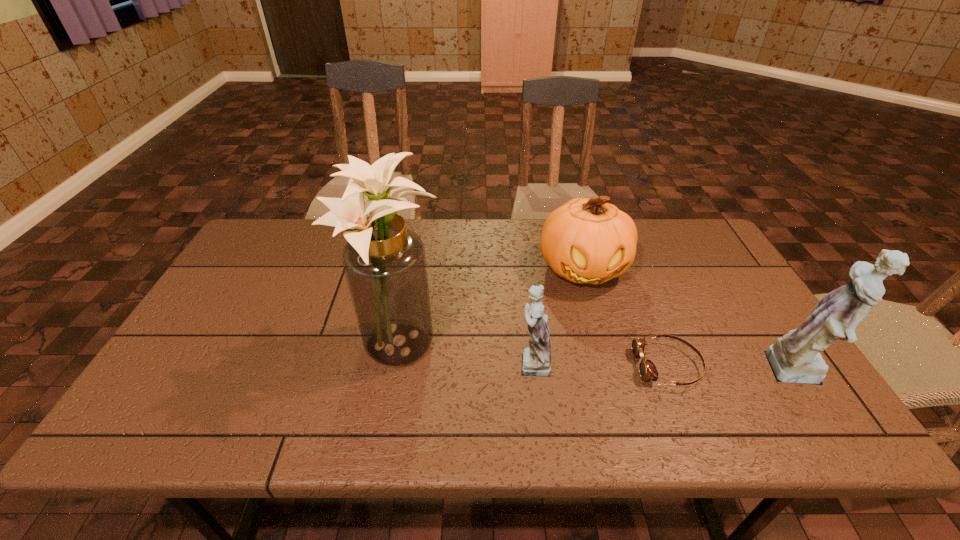
Locate an element on the screen. the left figurine is located at coordinates (536, 360).

In order to click on the rightmost object in this screenshot , I will do `click(795, 358)`.

Image resolution: width=960 pixels, height=540 pixels. I want to click on the taller figurine, so click(x=795, y=358).

Where is `the farthest object`? the farthest object is located at coordinates click(x=587, y=240).

The height and width of the screenshot is (540, 960). In order to click on goggles in this screenshot , I will do `click(647, 369)`.

Locate an element on the screen. flower arrangement is located at coordinates [x=384, y=262].

The height and width of the screenshot is (540, 960). I want to click on the tallest object, so click(384, 262).

Find the location of a particular element. The height and width of the screenshot is (540, 960). free space located 0.070m on the front-facing side of the shorter figurine is located at coordinates (482, 362).

Locate an element on the screen. The height and width of the screenshot is (540, 960). vacant area situated on the front-facing side of the shorter figurine is located at coordinates (354, 362).

This screenshot has height=540, width=960. In order to click on vacant space located 0.350m on the front-facing side of the shorter figurine in this screenshot , I will do `click(367, 362)`.